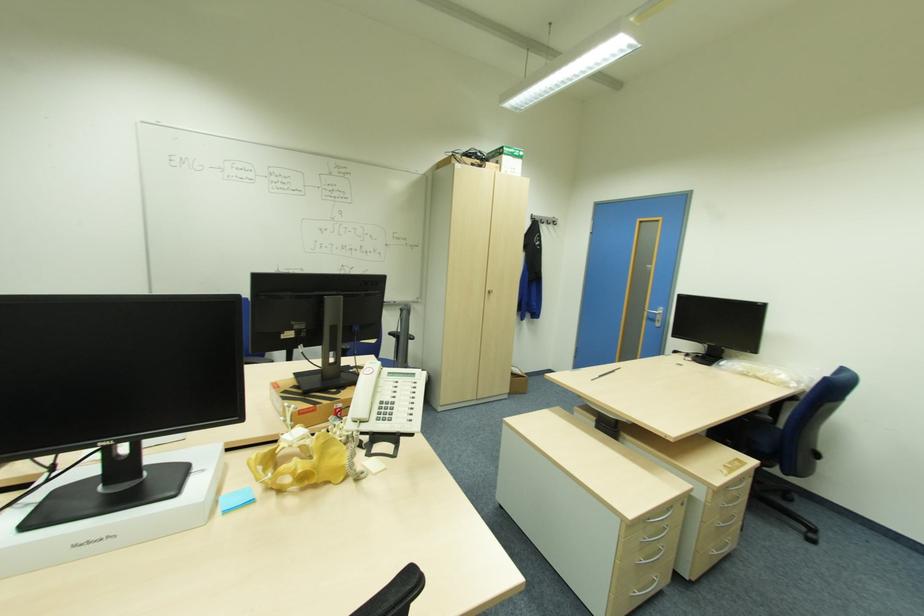
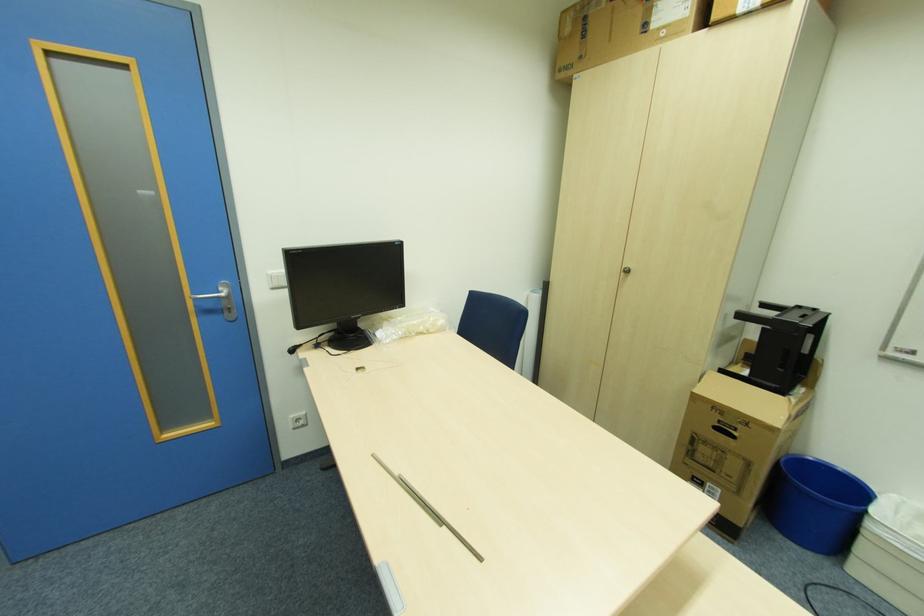
The point at (762, 374) is marked in the first image. Where is the corresponding point in the second image?

(424, 329)